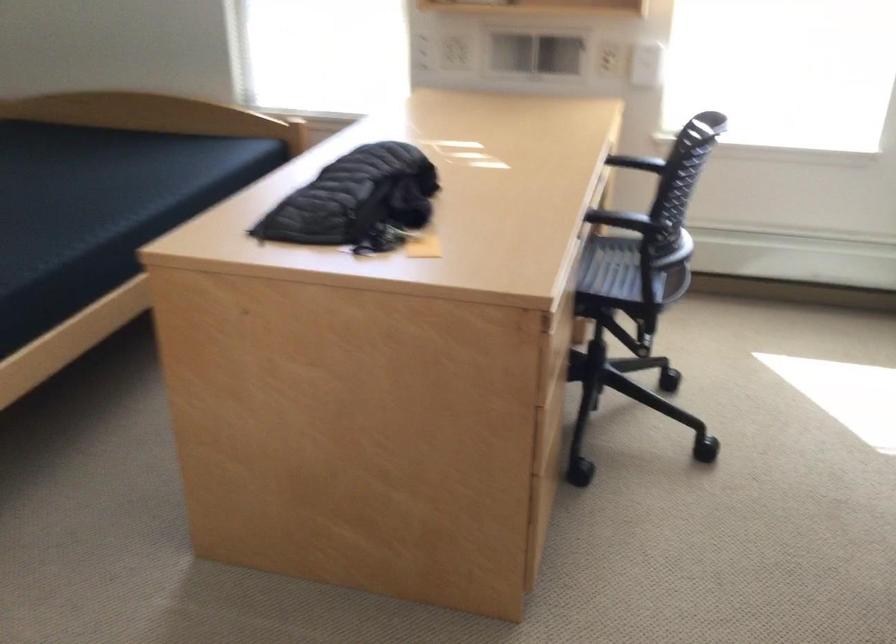
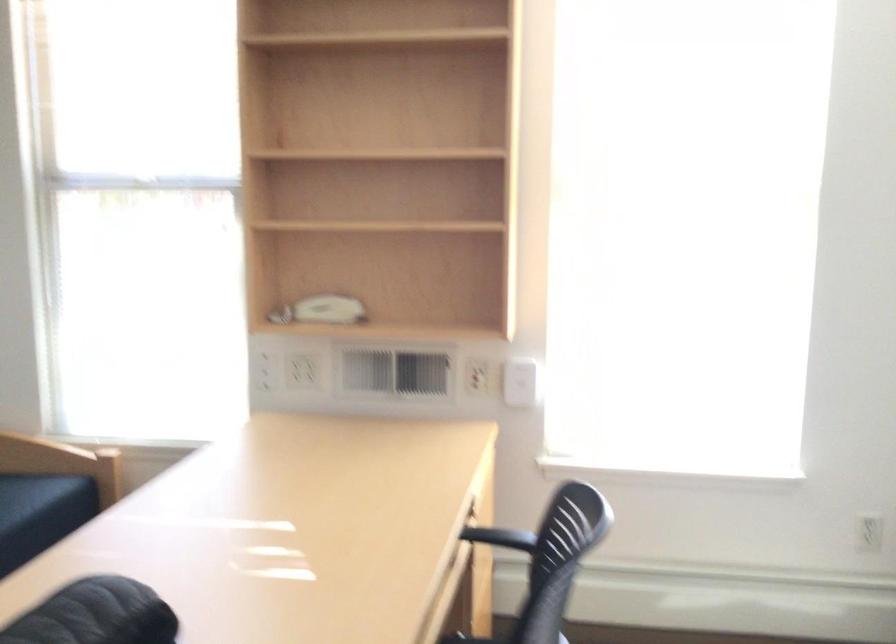
Question: Based on the continuous images, in which direction is the camera rotating? Reply with the corresponding letter.

Choices:
 (A) Left
 (B) Right
 (C) Up
 (D) Down

Answer: (C)